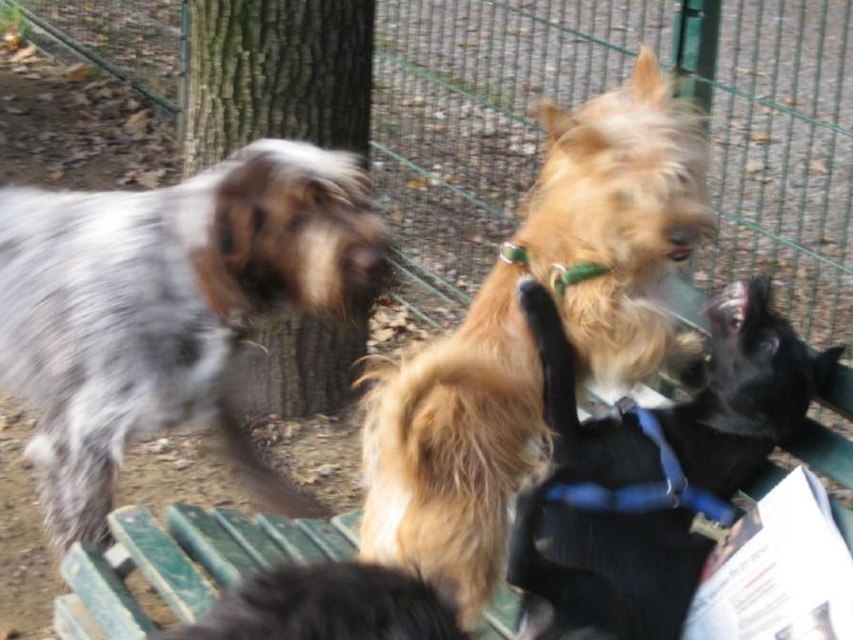
You are a small cat trying to jump over the green wire mesh at upper center and the shaggy golden fur at center. Which one is taller and harder to jump over?

The green wire mesh at upper center is taller than the shaggy golden fur at center, so it would be harder for the cat to jump over.

You are a photographer trying to capture a clear shot of the shaggy golden fur at center and the green wire mesh at upper center. Which object is closer to the camera?

The green wire mesh at upper center is closer to the camera since the shaggy golden fur at center is positioned behind it.

You are a dog owner who wants to separate your two dogs, the shaggy golden fur at center and the black fur dog at center, using a divider that is 15 inches wide. Can the divider fit between them without touching either dog?

The distance between the shaggy golden fur at center and the black fur dog at center is 16.09 inches. Since the divider is 15 inches wide, there is 1.09 inches of extra space, so yes, the divider can fit between them without touching either dog.